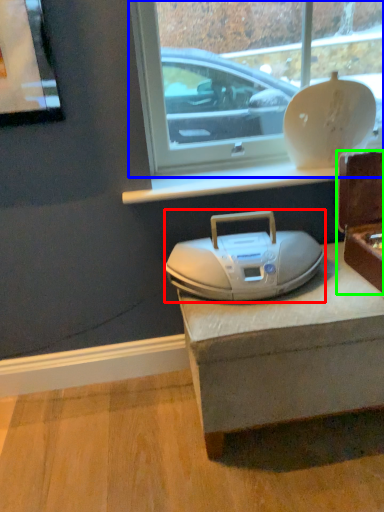
Question: Based on their relative distances, which object is farther from appliance (highlighted by a red box)? Choose from window (highlighted by a blue box) and box (highlighted by a green box).

Choices:
 (A) window
 (B) box

Answer: (A)